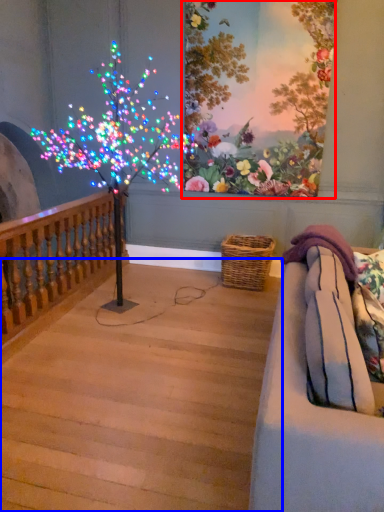
Question: Which object appears farthest to the camera in this image, floral arrangement (highlighted by a red box) or stairwell (highlighted by a blue box)?

Choices:
 (A) floral arrangement
 (B) stairwell

Answer: (A)